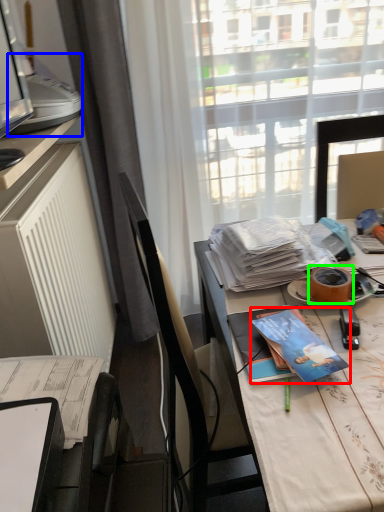
Question: Which object is the farthest from book (highlighted by a red box)? Choose among these: printer (highlighted by a blue box) or adhesive tape (highlighted by a green box).

Choices:
 (A) printer
 (B) adhesive tape

Answer: (A)